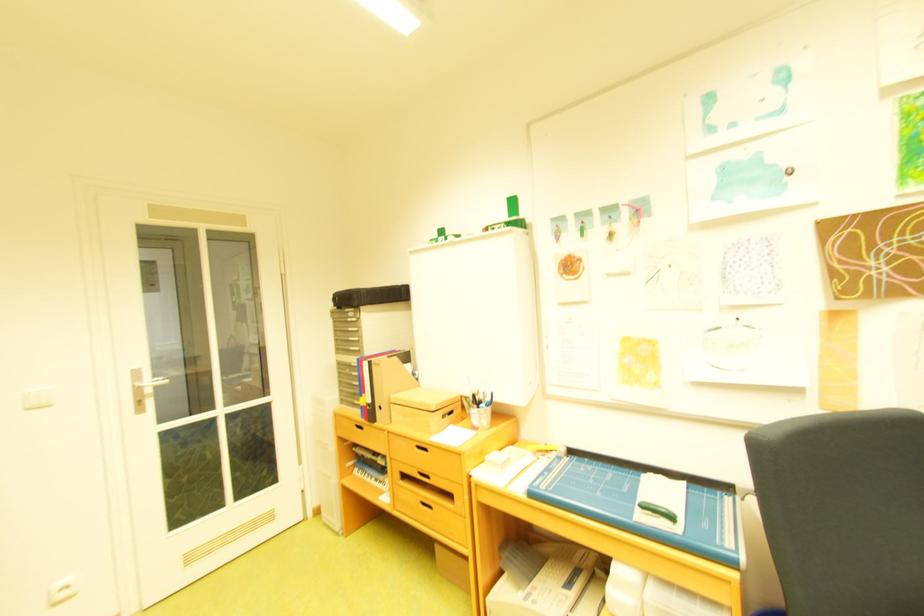
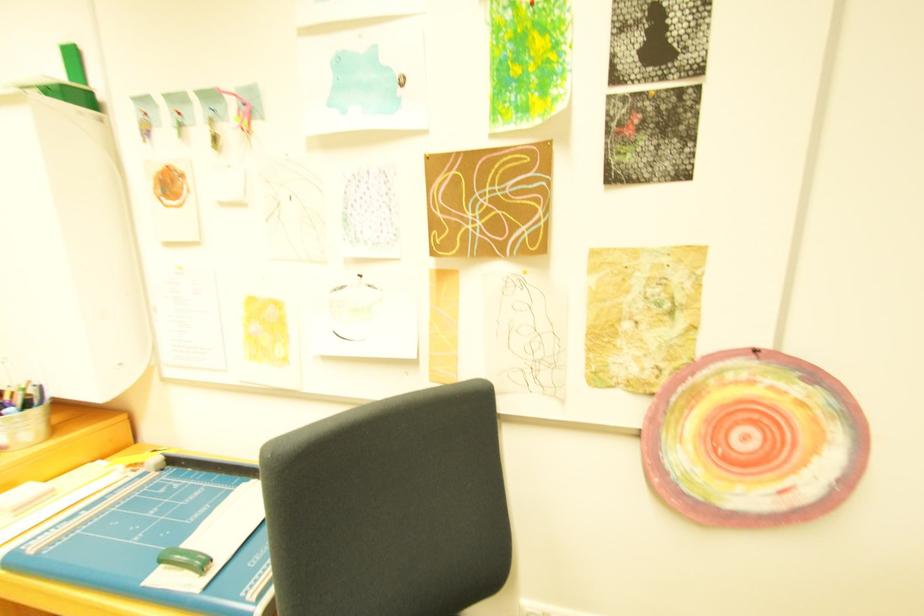
Question: The images are taken continuously from a first-person perspective. In which direction are you moving?

Choices:
 (A) Left
 (B) Right
 (C) Forward
 (D) Backward

Answer: (B)